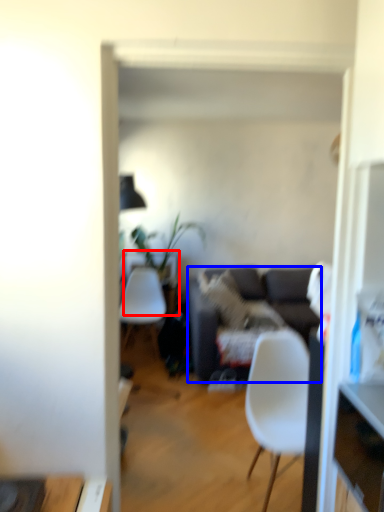
Question: Which point is closer to the camera, desk (highlighted by a red box) or studio couch (highlighted by a blue box)?

Choices:
 (A) desk
 (B) studio couch

Answer: (B)